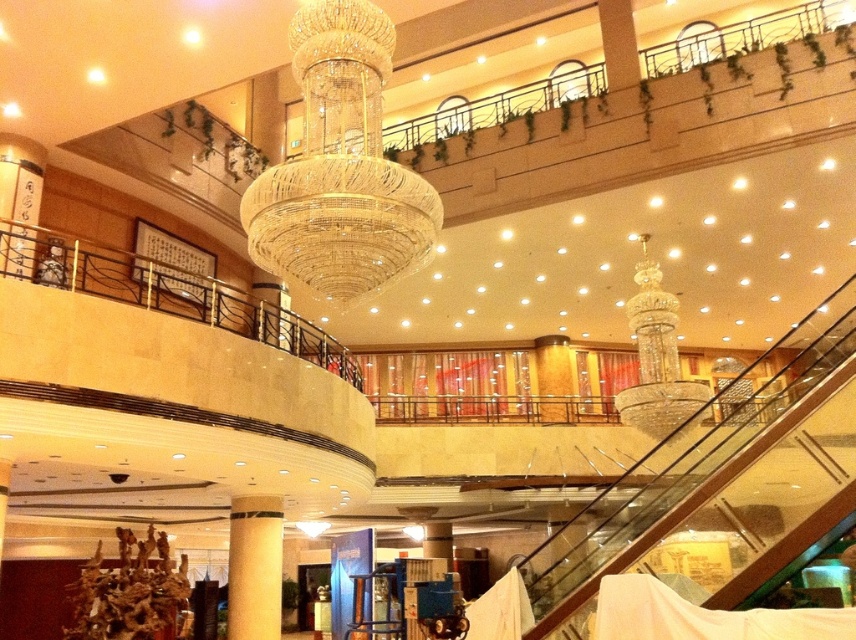
Locate an element on the screen. This screenshot has height=640, width=856. clear crystal chandelier at center is located at coordinates (340, 166).

Does clear crystal chandelier at center have a lesser height compared to yellow textured pillar at center?

No, clear crystal chandelier at center is not shorter than yellow textured pillar at center.

The width and height of the screenshot is (856, 640). What do you see at coordinates (340, 166) in the screenshot?
I see `clear crystal chandelier at center` at bounding box center [340, 166].

The image size is (856, 640). What are the coordinates of `clear crystal chandelier at center` in the screenshot? It's located at tap(340, 166).